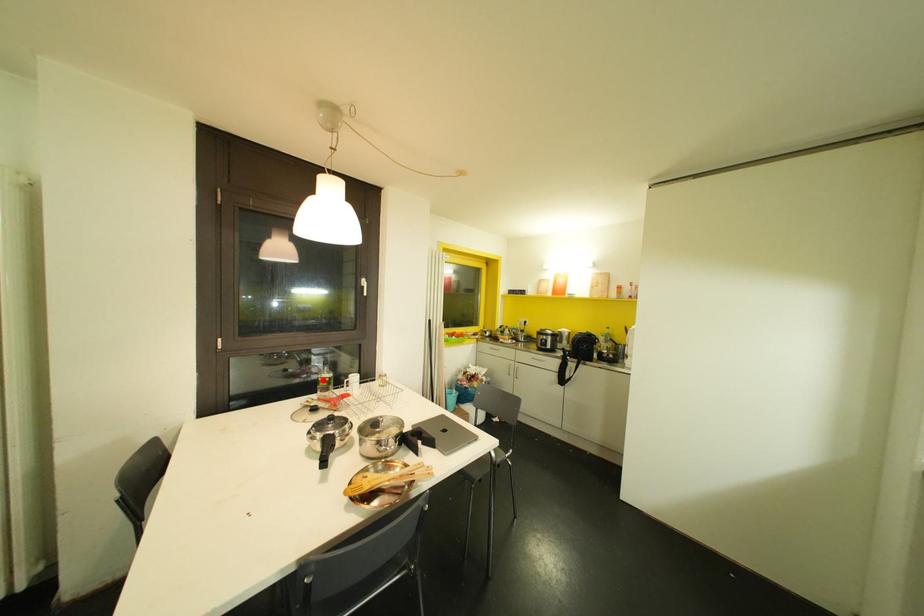
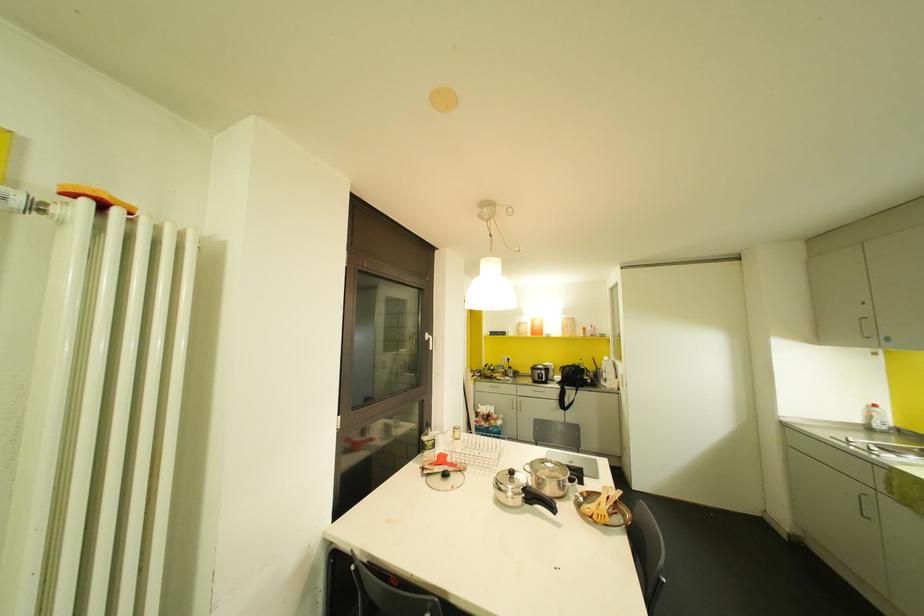
Locate, in the second image, the point that corresponds to the highlighted location in the first image.

(429, 444)